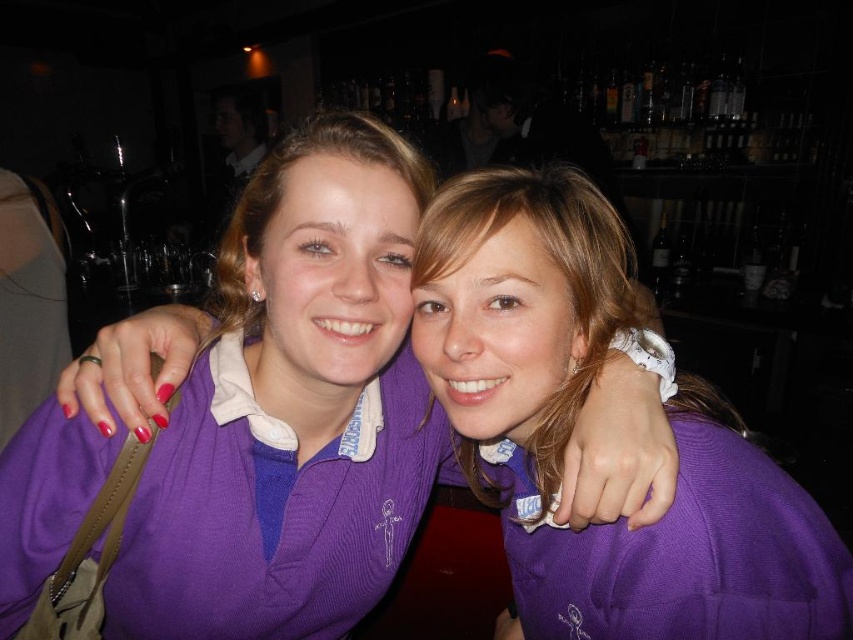
You are at a bar and want to take a photo of both the purple jersey at center and the purple ribbed sweater at center. Which one should you focus on first to ensure it appears sharp in the photo?

You should focus on the purple jersey at center first because it is closer to you than the purple ribbed sweater at center, so focusing on it will keep it sharp while the sweater may appear slightly blurred.

You are organizing a charity event and need to decide which clothing item to display prominently. Given that the purple jersey at center and the purple ribbed sweater at center are both available, which one would take up more space when displayed side by side?

The purple jersey at center is larger in size than the purple ribbed sweater at center, so it would take up more space when displayed side by side.

You are organizing a clothing donation drive and need to determine if the purple jersey at center and the purple ribbed sweater at center can fit side by side on a shelf that is 1 meter wide. Based on their widths, will they both fit?

The purple jersey at center is wider than the purple ribbed sweater at center. Since the total width of both items combined would exceed 1 meter, they might not fit side by side on the shelf.